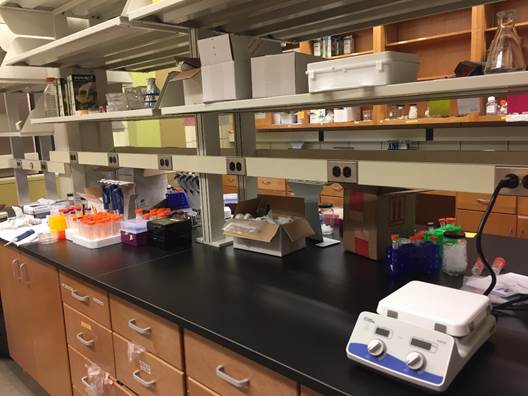
Locate an element on the screen. This screenshot has height=396, width=528. drawer pulls is located at coordinates (82, 299), (83, 341), (84, 383), (139, 330), (150, 383), (223, 375), (479, 201), (264, 182), (336, 190).